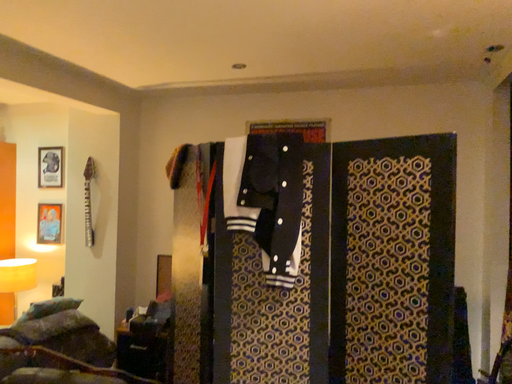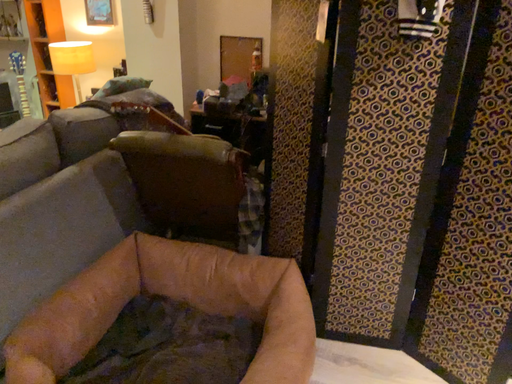
Question: How did the camera likely rotate when shooting the video?

Choices:
 (A) rotated downward
 (B) rotated upward

Answer: (A)